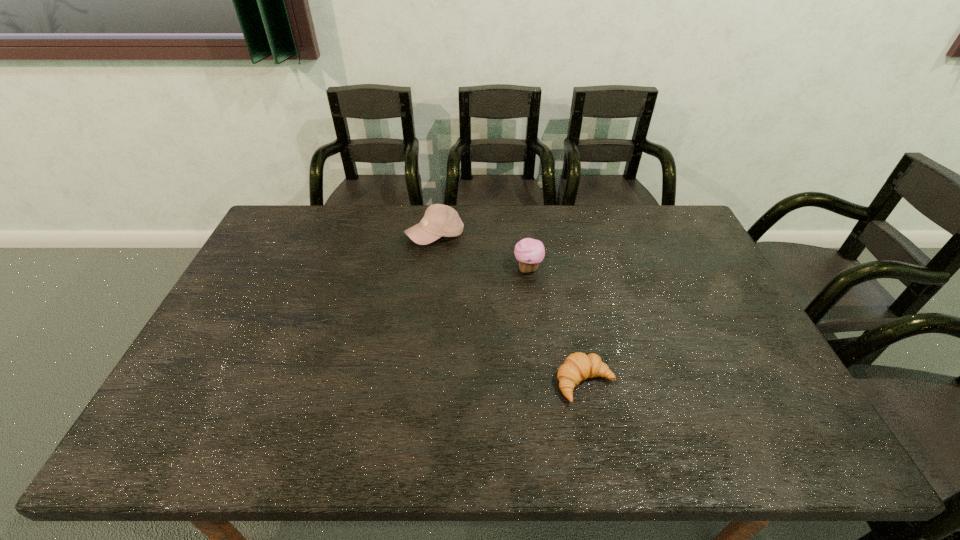
Image resolution: width=960 pixels, height=540 pixels. Find the location of `free spot that satisfies the following two spatial constraints: 1. on the front-facing side of the farthest object; 2. on the right side of the shortest object`. free spot that satisfies the following two spatial constraints: 1. on the front-facing side of the farthest object; 2. on the right side of the shortest object is located at coordinates (x=418, y=383).

Where is `free space that satisfies the following two spatial constraints: 1. on the front side of the second farthest object; 2. on the right side of the shortest object`? The width and height of the screenshot is (960, 540). free space that satisfies the following two spatial constraints: 1. on the front side of the second farthest object; 2. on the right side of the shortest object is located at coordinates (541, 383).